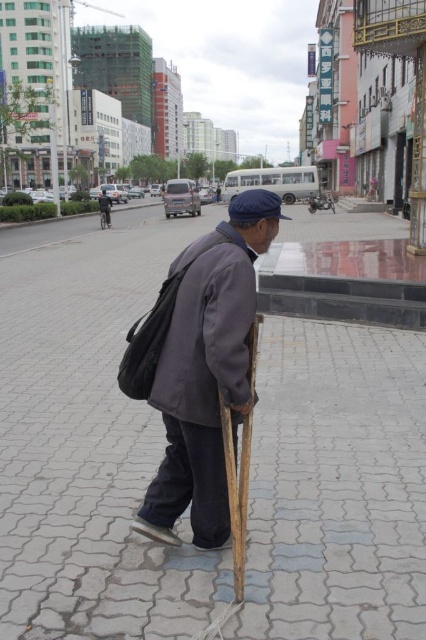
This screenshot has width=426, height=640. In order to click on dark gray fabric jacket at center in this screenshot , I will do `click(207, 371)`.

Can you confirm if dark gray fabric jacket at center is bigger than dark gray woolen jacket at center?

Yes.

I want to click on dark gray fabric jacket at center, so click(207, 371).

What do you see at coordinates (88, 440) in the screenshot? I see `gray cobblestone pavement at center` at bounding box center [88, 440].

Who is taller, gray cobblestone pavement at center or dark gray fabric jacket at center?

With more height is gray cobblestone pavement at center.

Which is behind, point (25, 396) or point (184, 458)?

The point (25, 396) is behind.

The height and width of the screenshot is (640, 426). In order to click on gray cobblestone pavement at center in this screenshot , I will do `click(88, 440)`.

Between point (377, 436) and point (247, 269), which one is positioned in front?

Point (247, 269) is in front.

Can you confirm if gray cobblestone pavement at center is wider than dark gray woolen jacket at center?

Indeed, gray cobblestone pavement at center has a greater width compared to dark gray woolen jacket at center.

Is point (365, 461) farther from camera compared to point (186, 320)?

Yes, point (365, 461) is behind point (186, 320).

Where is `gray cobblestone pavement at center`? The width and height of the screenshot is (426, 640). gray cobblestone pavement at center is located at coordinates (88, 440).